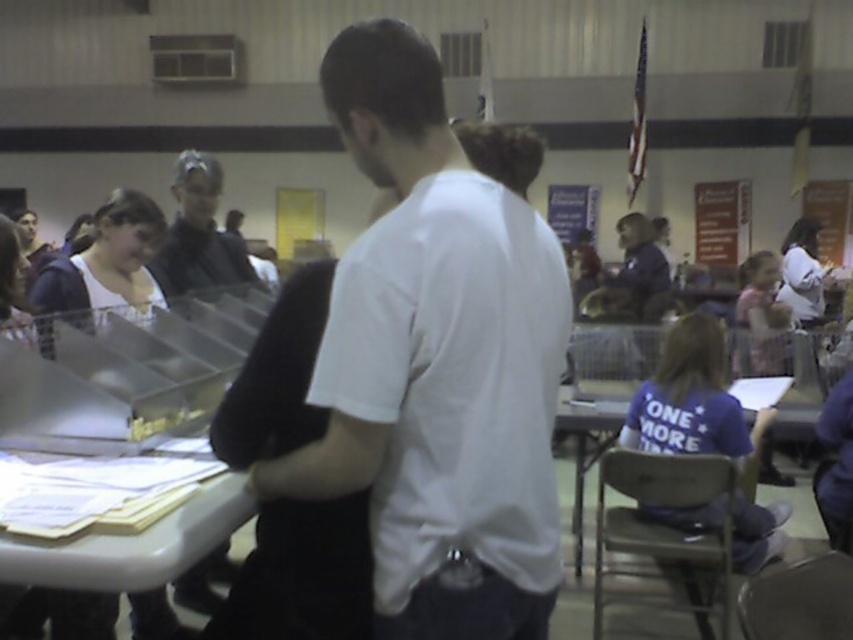
You are attending an event and need to fill out a form. You see a wooden table at lower right and a dark blue shirt at center. Which object is located to the left of the other?

The wooden table at lower right is positioned on the left side of dark blue shirt at center.

You are standing at the point labeled point [252,534] and want to walk to the point labeled point [628,276]. Given that you can only move forward in a straight line, will you be able to reach the destination without turning around?

Since point [628,276] is behind point [252,534], you would need to move backward or turn around to reach it while moving forward in a straight line. Therefore, you cannot reach the destination without turning around.

You are organizing a registration event and need to place a 1.2 meter tall banner between the wooden table at lower right and the dark blue shirt at center. Can the banner fit vertically between them?

The wooden table at lower right is not as tall as dark blue shirt at center. Since the banner is 1.2 meters tall, it may not fit vertically between them if the distance between the table and the shirt is less than 1.2 meters. However, the description only mentions their heights relative to each other, not the distance between them. Therefore, we cannot determine if the banner will fit based on the provided information.